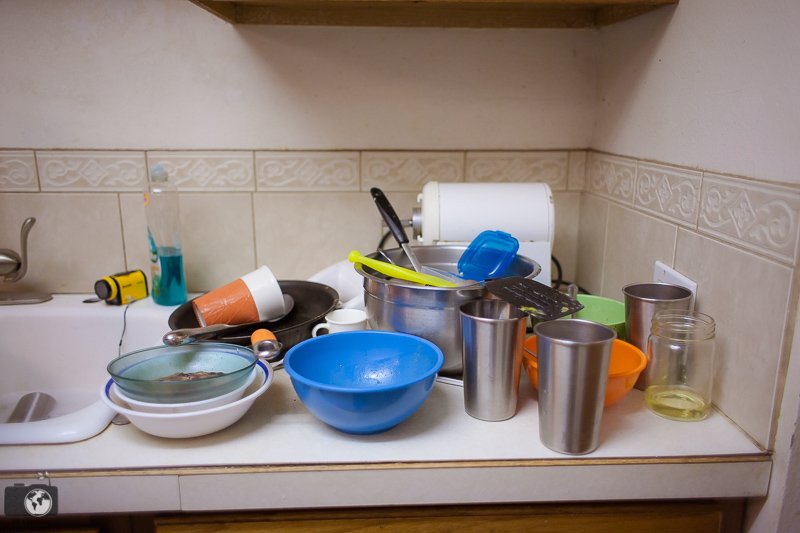
At what (x,y) coordinates should I click in order to perform the action: click on dish soap. Please return your answer as a coordinate pair (x, y). Looking at the image, I should click on pyautogui.click(x=164, y=220).